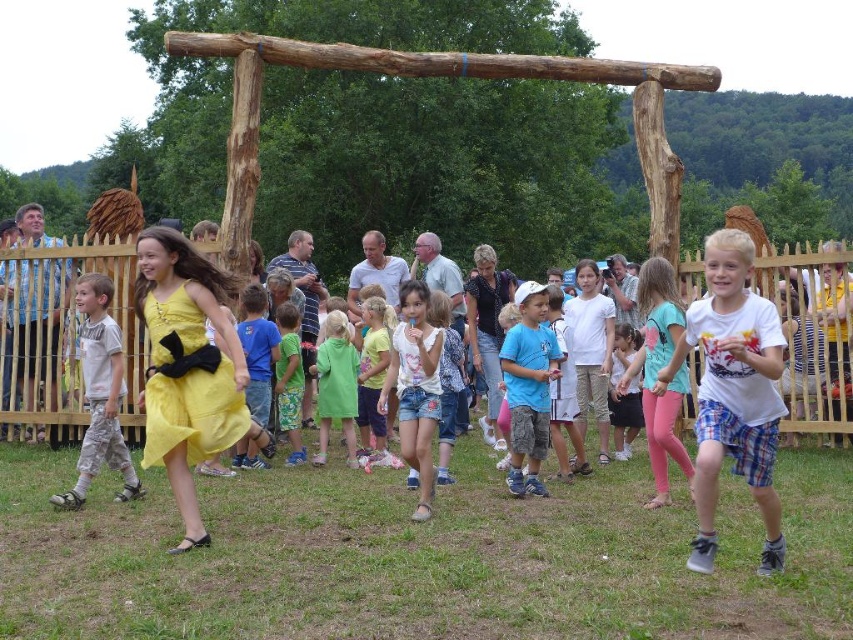
You are at the community event and see two children wearing the yellow chiffon dress at center and the blue cotton shirt at center. If you are facing the wooden archway, which child is standing closer to your left side?

The yellow chiffon dress at center is to the left of blue cotton shirt at center, so the child wearing the yellow chiffon dress at center is closer to your left side when facing the wooden archway.

You are standing in the middle of the grassy field where the children are playing. You notice two points marked in the image. Which point is closer to you, point at coordinates (410, 380) or point at coordinates (322, 406)?

Point at coordinates (410, 380) is closer to you than point at coordinates (322, 406).